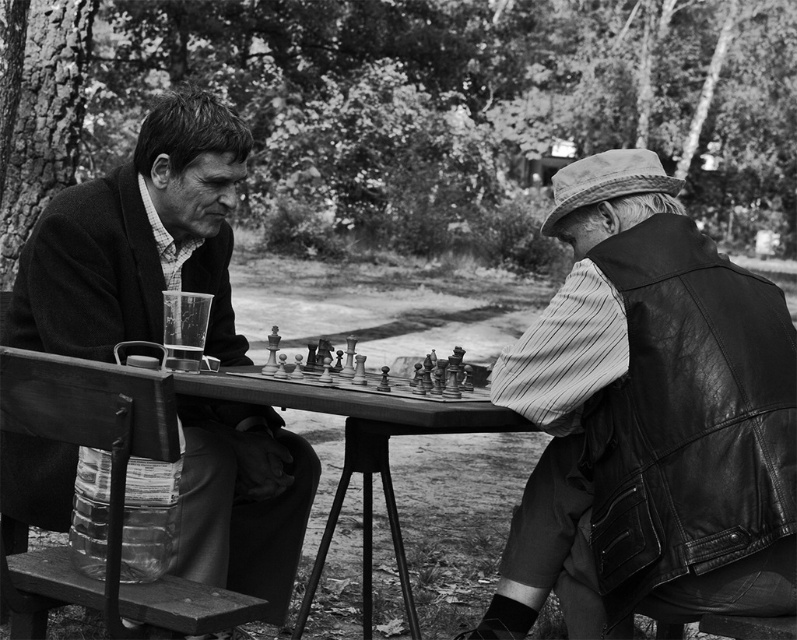
Question: Which object is farther from the camera taking this photo?

Choices:
 (A) wooden chess set at center
 (B) matte black jacket at left
 (C) wooden picnic table at center

Answer: (B)

Question: Which object is positioned farthest from the leather vest at right?

Choices:
 (A) wooden picnic table at center
 (B) matte black jacket at left

Answer: (B)

Question: Which point is closer to the camera taking this photo?

Choices:
 (A) (576, 301)
 (B) (476, 392)
 (C) (177, 557)
 (D) (385, 413)

Answer: (D)

Question: Is leather vest at right bigger than wooden chess set at center?

Choices:
 (A) no
 (B) yes

Answer: (B)

Question: In this image, where is matte black jacket at left located relative to wooden picnic table at center?

Choices:
 (A) above
 (B) below

Answer: (A)

Question: Is matte black jacket at left positioned before wooden chess set at center?

Choices:
 (A) yes
 (B) no

Answer: (B)